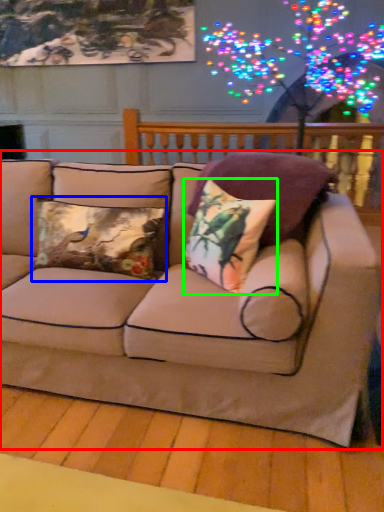
Question: Which is farther away from studio couch (highlighted by a red box)? pillow (highlighted by a blue box) or pillow (highlighted by a green box)?

Choices:
 (A) pillow
 (B) pillow

Answer: (A)